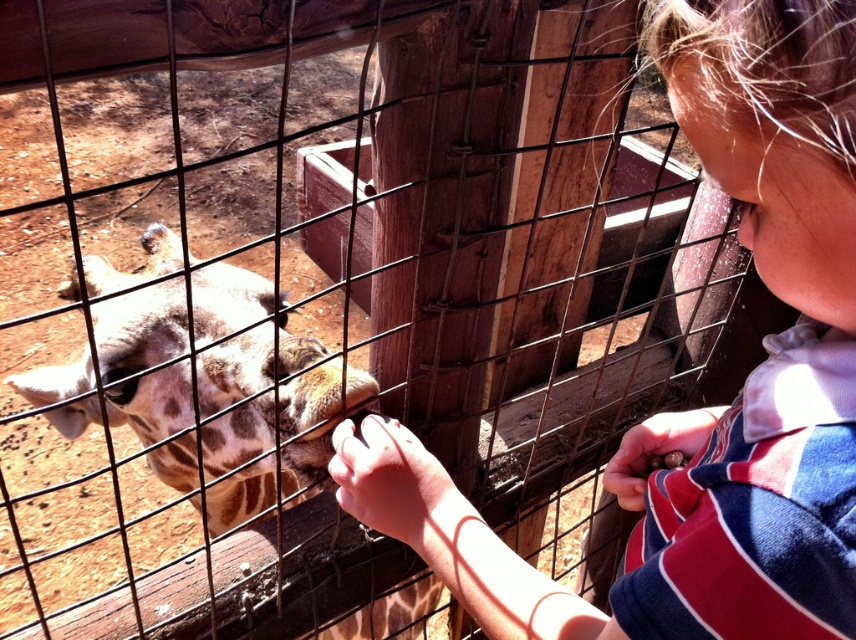
Question: Can you confirm if spotted fur giraffe at left is positioned to the right of spotted fur mouth at center?

Choices:
 (A) yes
 (B) no

Answer: (B)

Question: Which object appears closest to the camera in this image?

Choices:
 (A) spotted fur mouth at center
 (B) matte skin nose at upper right
 (C) spotted fur giraffe at left

Answer: (B)

Question: Is the position of sun-kissed skin at center more distant than that of matte skin nose at upper right?

Choices:
 (A) no
 (B) yes

Answer: (B)

Question: Which is farther from the spotted fur giraffe at left?

Choices:
 (A) matte skin nose at upper right
 (B) sun-kissed skin at center
 (C) smooth brown nut at center

Answer: (A)

Question: Estimate the real-world distances between objects in this image. Which object is closer to the spotted fur mouth at center?

Choices:
 (A) spotted fur giraffe at left
 (B) sun-kissed skin at center
 (C) striped cotton shirt at center

Answer: (B)

Question: Does sun-kissed skin at center have a smaller size compared to smooth brown nut at center?

Choices:
 (A) yes
 (B) no

Answer: (B)